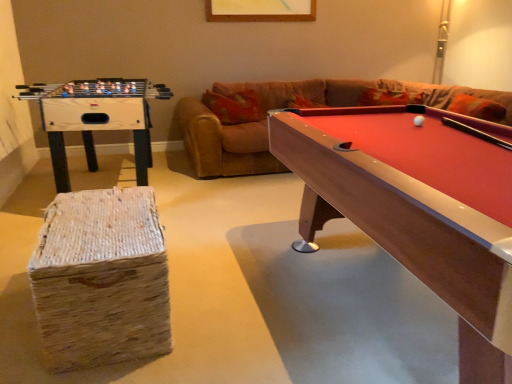
Question: Is woven straw stool at lower left completely or partially outside of wooden foosball table at left?

Choices:
 (A) no
 (B) yes

Answer: (B)

Question: From a real-world perspective, does woven straw stool at lower left sit lower than wooden foosball table at left?

Choices:
 (A) yes
 (B) no

Answer: (A)

Question: Is woven straw stool at lower left turned away from wooden foosball table at left?

Choices:
 (A) yes
 (B) no

Answer: (B)

Question: Does woven straw stool at lower left have a greater height compared to wooden foosball table at left?

Choices:
 (A) yes
 (B) no

Answer: (B)

Question: From the image's perspective, is woven straw stool at lower left beneath wooden foosball table at left?

Choices:
 (A) no
 (B) yes

Answer: (B)

Question: From a real-world perspective, relative to white matte ball at center-right, is wooden foosball table at left vertically above or below?

Choices:
 (A) below
 (B) above

Answer: (A)

Question: Is wooden foosball table at left in front of or behind white matte ball at center-right in the image?

Choices:
 (A) front
 (B) behind

Answer: (B)

Question: Considering the relative positions of wooden foosball table at left and white matte ball at center-right in the image provided, is wooden foosball table at left to the left or to the right of white matte ball at center-right?

Choices:
 (A) right
 (B) left

Answer: (B)

Question: From the image's perspective, is wooden foosball table at left above or below white matte ball at center-right?

Choices:
 (A) above
 (B) below

Answer: (A)

Question: Considering the relative positions of woven straw stool at lower left and rubberized wood billiard table at right in the image provided, is woven straw stool at lower left to the left or to the right of rubberized wood billiard table at right?

Choices:
 (A) left
 (B) right

Answer: (A)

Question: From the image's perspective, is woven straw stool at lower left located above or below rubberized wood billiard table at right?

Choices:
 (A) above
 (B) below

Answer: (B)

Question: Is woven straw stool at lower left inside the boundaries of rubberized wood billiard table at right, or outside?

Choices:
 (A) inside
 (B) outside

Answer: (B)

Question: Considering the positions of point (138, 271) and point (375, 124), is point (138, 271) closer or farther from the camera than point (375, 124)?

Choices:
 (A) closer
 (B) farther

Answer: (A)

Question: Is rubberized wood billiard table at right bigger or smaller than woven straw stool at lower left?

Choices:
 (A) big
 (B) small

Answer: (A)

Question: From a real-world perspective, relative to woven straw stool at lower left, is rubberized wood billiard table at right vertically above or below?

Choices:
 (A) above
 (B) below

Answer: (A)